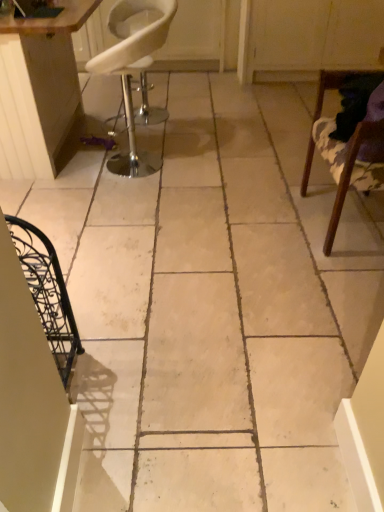
Question: From the image's perspective, does white plastic chair at upper left, marked as the 2th chair in a right-to-left arrangement, appear lower than wooden table at upper left?

Choices:
 (A) yes
 (B) no

Answer: (A)

Question: Does white plastic chair at upper left, marked as the 2th chair in a right-to-left arrangement, lie behind wooden table at upper left?

Choices:
 (A) yes
 (B) no

Answer: (B)

Question: Considering the relative sizes of white plastic chair at upper left, which is counted as the first chair, starting from the left, and wooden table at upper left in the image provided, is white plastic chair at upper left, which is counted as the first chair, starting from the left, bigger than wooden table at upper left?

Choices:
 (A) no
 (B) yes

Answer: (A)

Question: Can you confirm if white plastic chair at upper left, which is counted as the first chair, starting from the left, is shorter than wooden table at upper left?

Choices:
 (A) no
 (B) yes

Answer: (B)

Question: Is white plastic chair at upper left, which is counted as the first chair, starting from the left, completely or partially outside of wooden table at upper left?

Choices:
 (A) no
 (B) yes

Answer: (B)

Question: From their relative heights in the image, would you say wooden chair at right, which ranks as the second chair in left-to-right order, is taller or shorter than wooden table at upper left?

Choices:
 (A) tall
 (B) short

Answer: (B)

Question: Based on their positions, is wooden chair at right, which ranks as the second chair in left-to-right order, located to the left or right of wooden table at upper left?

Choices:
 (A) left
 (B) right

Answer: (B)

Question: Based on their sizes in the image, would you say wooden chair at right, which ranks as the second chair in left-to-right order, is bigger or smaller than wooden table at upper left?

Choices:
 (A) small
 (B) big

Answer: (A)

Question: From a real-world perspective, relative to wooden table at upper left, is wooden chair at right, acting as the first chair starting from the right, vertically above or below?

Choices:
 (A) below
 (B) above

Answer: (A)

Question: Which is correct: wooden table at upper left is inside white plastic chair at upper left, which is counted as the first chair, starting from the left, or outside of it?

Choices:
 (A) outside
 (B) inside

Answer: (A)

Question: From a real-world perspective, relative to white plastic chair at upper left, which is counted as the first chair, starting from the left, is wooden table at upper left vertically above or below?

Choices:
 (A) above
 (B) below

Answer: (A)

Question: Considering their positions, is wooden table at upper left located in front of or behind white plastic chair at upper left, marked as the 2th chair in a right-to-left arrangement?

Choices:
 (A) front
 (B) behind

Answer: (B)

Question: Is wooden table at upper left to the left or to the right of white plastic chair at upper left, which is counted as the first chair, starting from the left, in the image?

Choices:
 (A) left
 (B) right

Answer: (A)

Question: Is wooden table at upper left situated inside wooden chair at right, which ranks as the second chair in left-to-right order, or outside?

Choices:
 (A) outside
 (B) inside

Answer: (A)

Question: From the image's perspective, is wooden table at upper left above or below wooden chair at right, which ranks as the second chair in left-to-right order?

Choices:
 (A) above
 (B) below

Answer: (A)